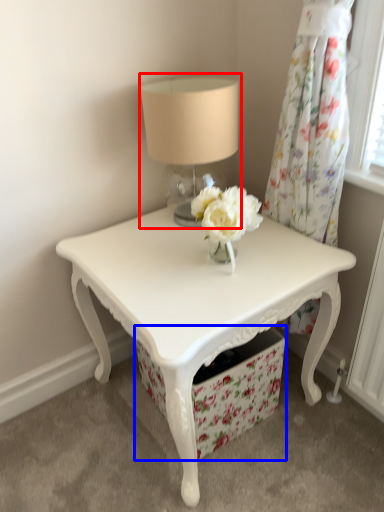
Question: Among these objects, which one is farthest to the camera, table lamp (highlighted by a red box) or drawer (highlighted by a blue box)?

Choices:
 (A) table lamp
 (B) drawer

Answer: (B)